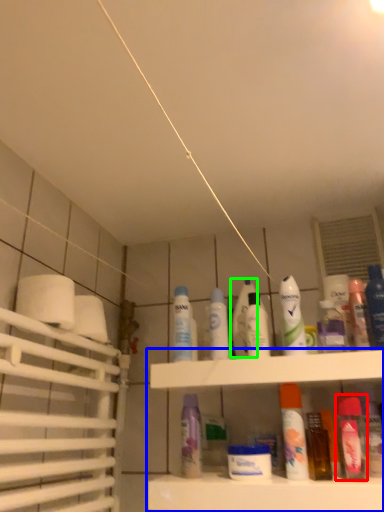
Question: Based on their relative distances, which object is farther from mouthwash (highlighted by a red box)? Choose from shelf (highlighted by a blue box) and toiletry (highlighted by a green box).

Choices:
 (A) shelf
 (B) toiletry

Answer: (B)